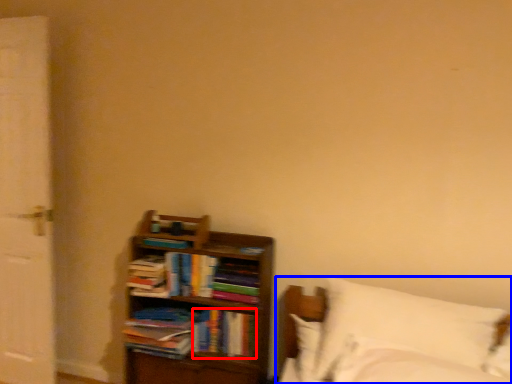
Question: Which object is further to the camera taking this photo, book (highlighted by a red box) or bed (highlighted by a blue box)?

Choices:
 (A) book
 (B) bed

Answer: (A)